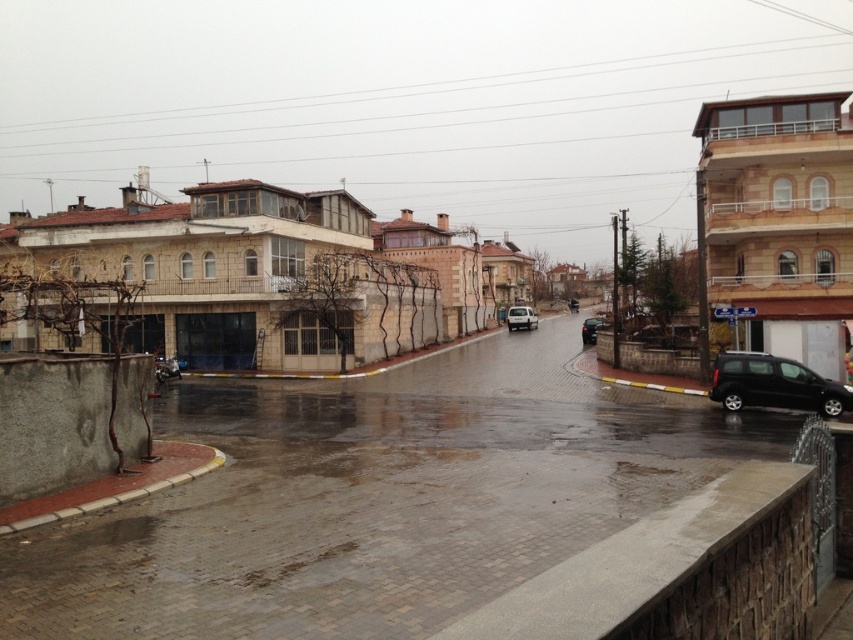
You are a delivery person who needs to park your vehicle in a spot that is only 1.5 meters in height. You see the black matte van at lower right and the metallic silver scooter at lower left. Which vehicle can fit into the parking spot based on their heights?

The metallic silver scooter at lower left can fit into the parking spot since the black matte van at lower right is much taller than it, exceeding the 1.5 meters height limit.

You are a delivery driver who needs to park your vehicle in this street. You have a van that is 2 meters wide. You see the black matte van at lower right and the white matte van at center. Which van can you park next to without overlapping if your van is 2 meters wide?

The black matte van at lower right might be wider than white matte van at center, so if your van is 2 meters wide, you should park next to the white matte van at center since it is narrower and there might be enough space.

You are standing at the point with coordinates point (517, 308) and want to walk to the point with coordinates point (776, 376). Given the wet street scene described, is the destination point in front of or behind your current position?

The destination point (776, 376) is in front of your current position at point (517, 308).